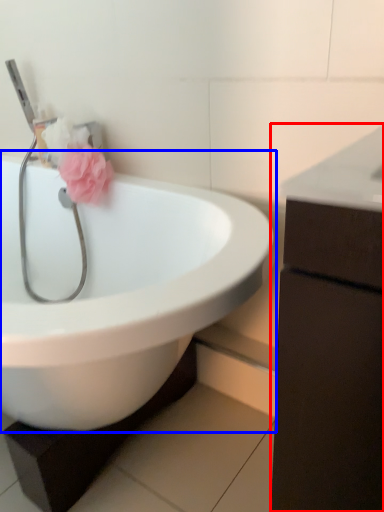
Question: Which object appears closest to the camera in this image, bathroom cabinet (highlighted by a red box) or sink (highlighted by a blue box)?

Choices:
 (A) bathroom cabinet
 (B) sink

Answer: (A)